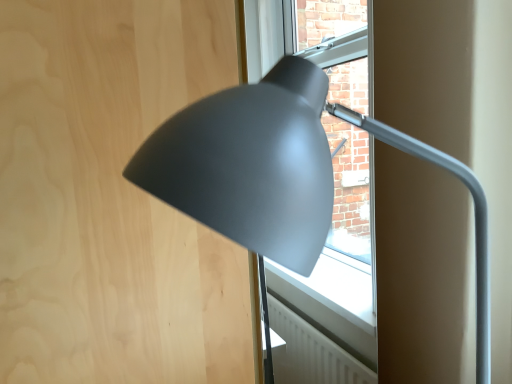
Question: From a real-world perspective, relative to matte gray lamp at center, is matte wood plywood at upper left vertically above or below?

Choices:
 (A) below
 (B) above

Answer: (A)

Question: Considering their positions, is matte wood plywood at upper left located in front of or behind matte gray lamp at center?

Choices:
 (A) front
 (B) behind

Answer: (B)

Question: Visually, is matte wood plywood at upper left positioned to the left or to the right of matte gray lamp at center?

Choices:
 (A) left
 (B) right

Answer: (A)

Question: Based on their positions, is matte gray lamp at center located to the left or right of matte wood plywood at upper left?

Choices:
 (A) right
 (B) left

Answer: (A)

Question: Is matte gray lamp at center bigger or smaller than matte wood plywood at upper left?

Choices:
 (A) big
 (B) small

Answer: (B)

Question: Considering the positions of matte gray lamp at center and matte wood plywood at upper left in the image, is matte gray lamp at center wider or thinner than matte wood plywood at upper left?

Choices:
 (A) thin
 (B) wide

Answer: (A)

Question: From a real-world perspective, relative to matte wood plywood at upper left, is matte gray lamp at center vertically above or below?

Choices:
 (A) above
 (B) below

Answer: (A)